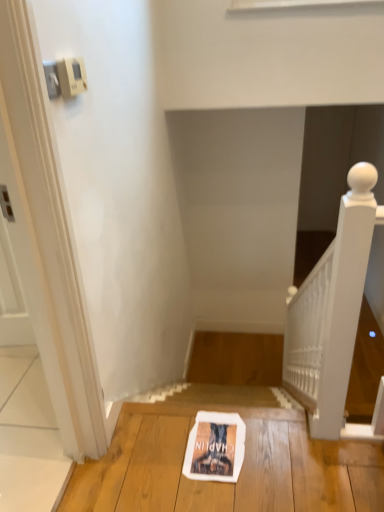
Question: Should I look upward or downward to see white paper flyer at center?

Choices:
 (A) down
 (B) up

Answer: (A)